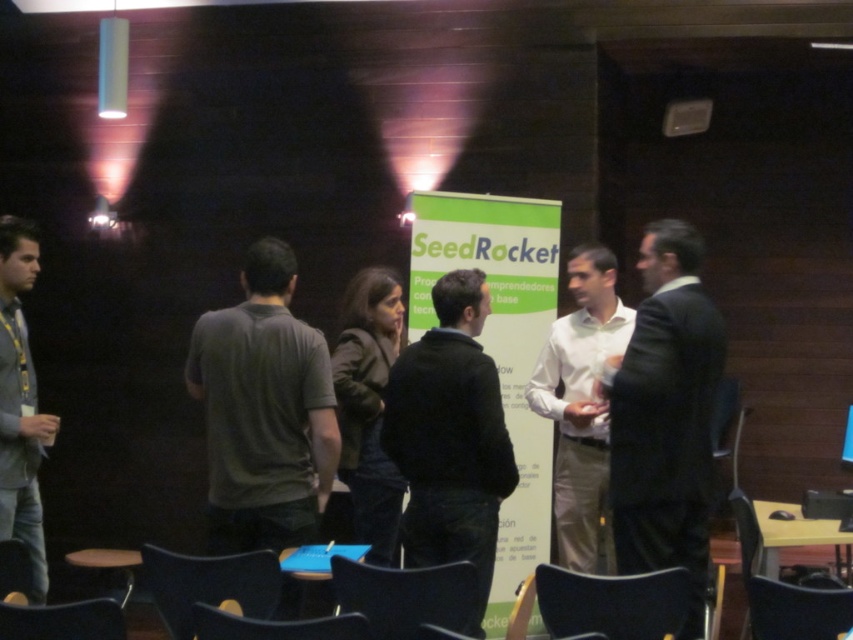
Question: Does dark blue sweater at center lie behind black plastic chair at lower left?

Choices:
 (A) no
 (B) yes

Answer: (B)

Question: Observing the image, what is the correct spatial positioning of gray fabric jacket at left in reference to black plastic chair at lower center?

Choices:
 (A) above
 (B) below

Answer: (A)

Question: Among these objects, which one is farthest from the camera?

Choices:
 (A) black plastic chair at lower center
 (B) velvet blue chair at lower center
 (C) gray fabric jacket at left

Answer: (C)

Question: Which point appears closest to the camera in this image?

Choices:
 (A) (401, 401)
 (B) (563, 500)
 (C) (3, 616)
 (D) (689, 246)

Answer: (C)

Question: Can you confirm if dark blue sweater at center is thinner than matte black chair at lower center?

Choices:
 (A) yes
 (B) no

Answer: (A)

Question: Which point is farther from the camera taking this photo?

Choices:
 (A) (312, 337)
 (B) (276, 573)

Answer: (A)